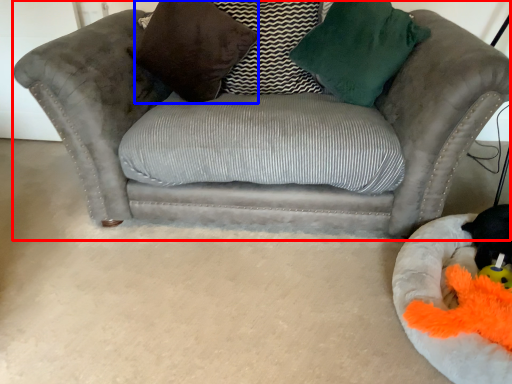
Question: Which point is further to the camera, studio couch (highlighted by a red box) or pillow (highlighted by a blue box)?

Choices:
 (A) studio couch
 (B) pillow

Answer: (B)